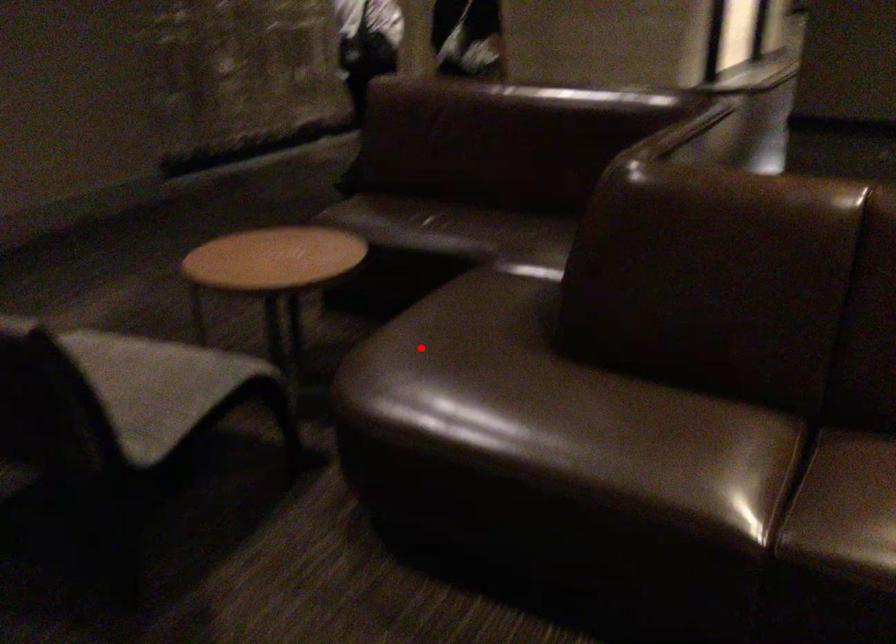
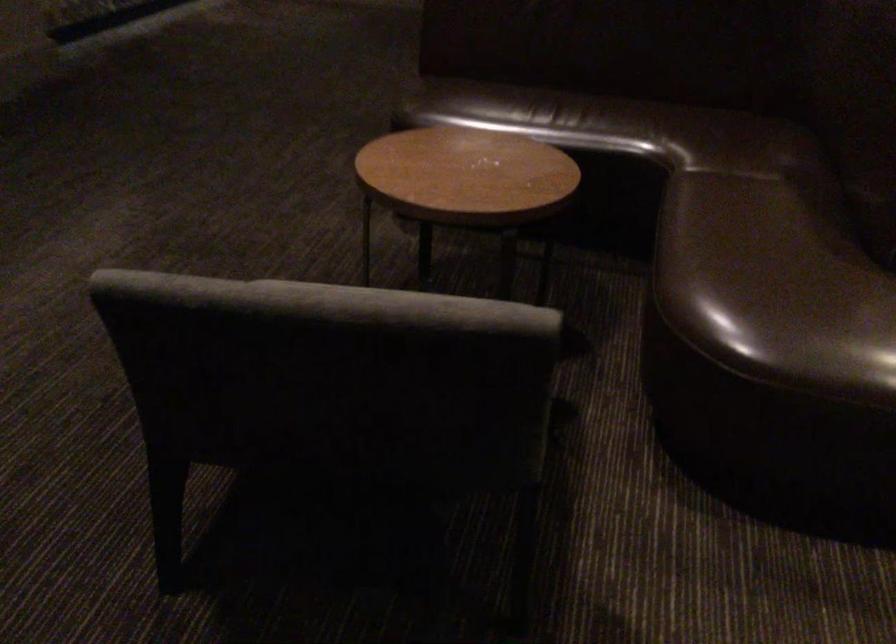
Question: I am providing you with two images of the same scene from different viewpoints. In image1, a red point is highlighted. Considering the same 3D point in image2, which of the following is correct?

Choices:
 (A) It is closer
 (B) It is farther

Answer: (A)